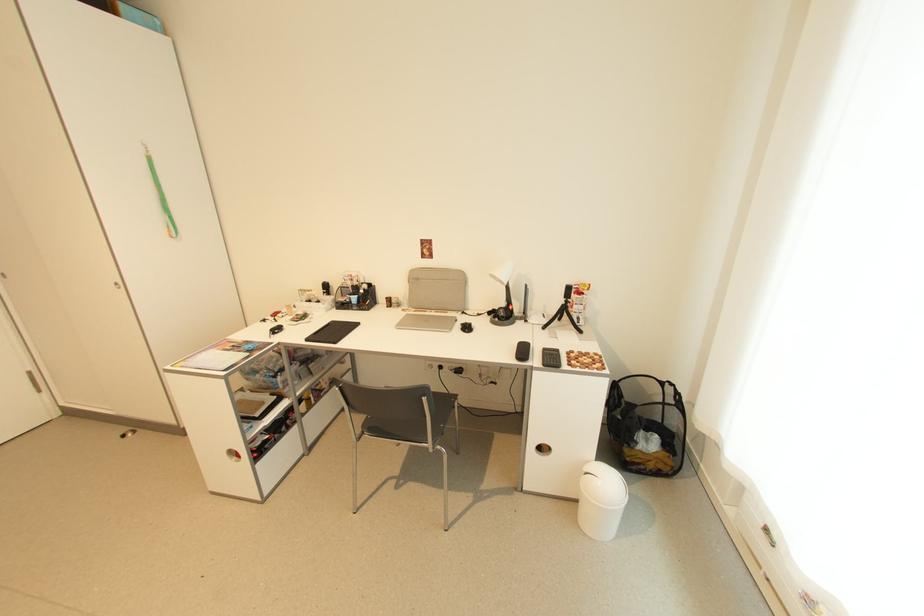
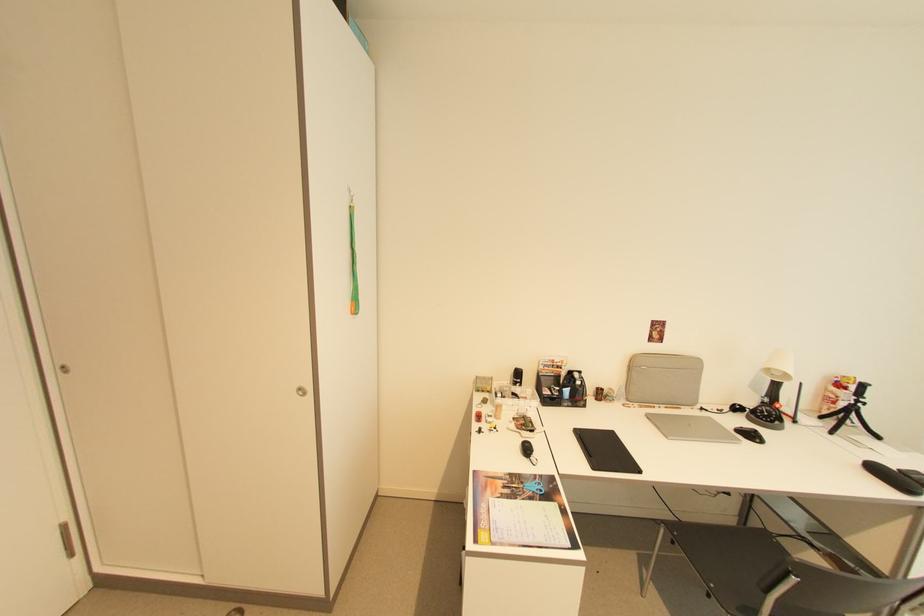
Question: In a continuous first-person perspective shot, in which direction is the camera moving?

Choices:
 (A) Left
 (B) Right
 (C) Forward
 (D) Backward

Answer: (A)